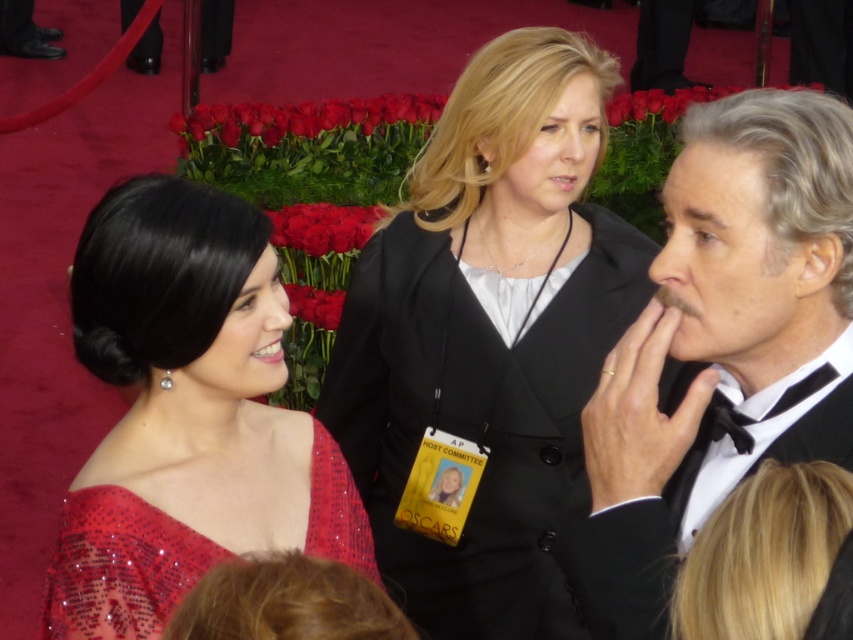
Question: Among these points, which one is farthest from the camera?

Choices:
 (A) (751, 547)
 (B) (219, 269)
 (C) (412, 385)
 (D) (827, 202)

Answer: (C)

Question: Does shiny sequined dress at center appear on the left side of satin sequined dress at lower left?

Choices:
 (A) yes
 (B) no

Answer: (A)

Question: Among these points, which one is farthest from the camera?

Choices:
 (A) (80, 584)
 (B) (119, 529)

Answer: (B)

Question: Is black satin tuxedo at center positioned in front of blonde hair at center?

Choices:
 (A) no
 (B) yes

Answer: (A)

Question: Is black satin tuxedo at center wider than satin sequined dress at lower left?

Choices:
 (A) no
 (B) yes

Answer: (A)

Question: Considering the real-world distances, which object is farthest from the black matte suit at center?

Choices:
 (A) blonde hair at center
 (B) shiny sequined dress at center

Answer: (A)